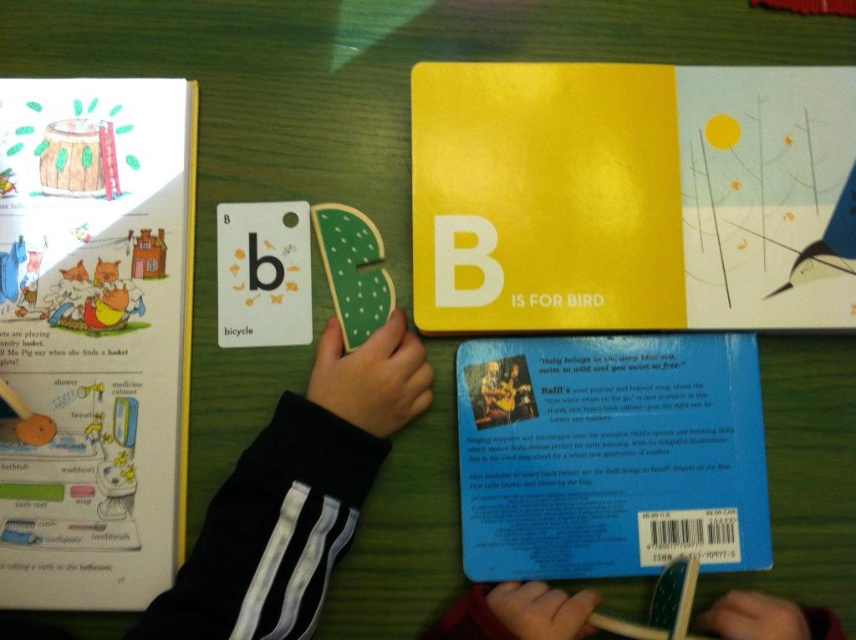
Question: Which of the following is the closest to the observer?

Choices:
 (A) black fabric hand at center
 (B) blue matte book at center

Answer: (A)

Question: Does yellow matte book at upper center appear on the right side of black fabric hand at center?

Choices:
 (A) no
 (B) yes

Answer: (B)

Question: Among these points, which one is nearest to the camera?

Choices:
 (A) (516, 576)
 (B) (187, 234)
 (C) (685, 200)
 (D) (563, 611)

Answer: (D)

Question: Is yellow matte book at upper center further to camera compared to black fabric hand at center?

Choices:
 (A) yes
 (B) no

Answer: (A)

Question: Among these objects, which one is nearest to the camera?

Choices:
 (A) blue matte book at center
 (B) black fabric hand at center
 (C) matte paper book at left
 (D) yellow matte book at upper center

Answer: (B)

Question: Is yellow matte book at upper center further to the viewer compared to blue matte book at center?

Choices:
 (A) no
 (B) yes

Answer: (B)